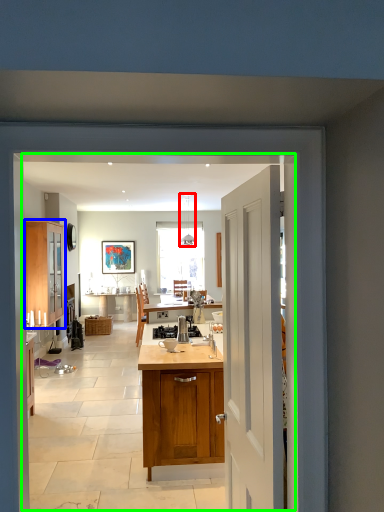
Question: Considering the real-world distances, which object is closest to lamp (highlighted by a red box)? cabinetry (highlighted by a blue box) or residence (highlighted by a green box).

Choices:
 (A) cabinetry
 (B) residence

Answer: (B)